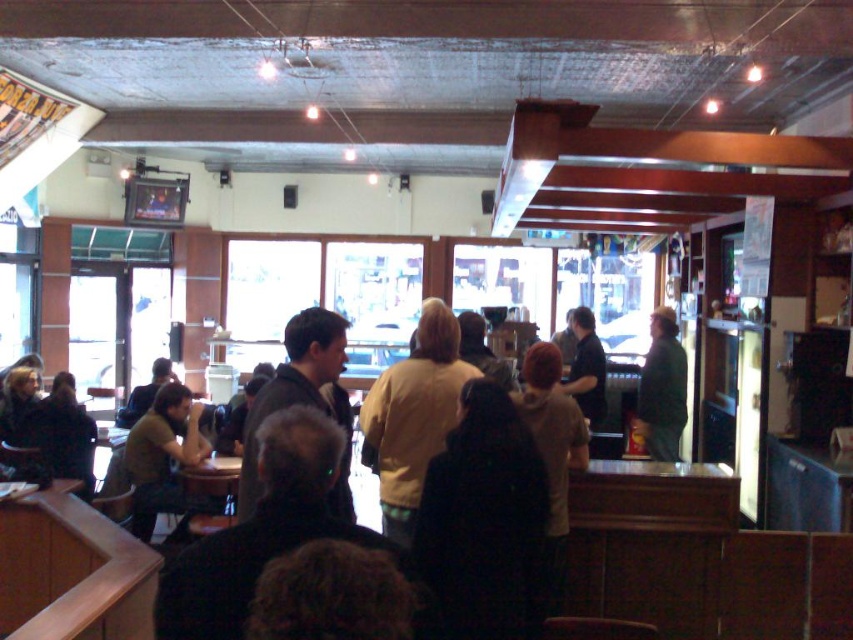
How much distance is there between light yellow jacket at center and green matte jacket at center?

light yellow jacket at center is 3.38 meters away from green matte jacket at center.

Is point (426, 403) in front of point (654, 355)?

Yes, point (426, 403) is in front of point (654, 355).

What are the coordinates of `light yellow jacket at center` in the screenshot? It's located at (413, 416).

Is point (178, 500) farther from viewer compared to point (674, 339)?

No, (178, 500) is closer to viewer.

Can you confirm if matte green shirt at left is bigger than green matte jacket at center?

Yes, matte green shirt at left is bigger than green matte jacket at center.

Which is in front, point (184, 432) or point (670, 433)?

Point (184, 432) is in front.

What are the coordinates of `matte green shirt at left` in the screenshot? It's located at (161, 456).

Measure the distance between light yellow jacket at center and camera.

9.23 feet

Is light yellow jacket at center further to the viewer compared to dark gray sweater at center?

Yes, it is.

What do you see at coordinates (413, 416) in the screenshot?
I see `light yellow jacket at center` at bounding box center [413, 416].

Locate an element on the screen. The height and width of the screenshot is (640, 853). light yellow jacket at center is located at coordinates (413, 416).